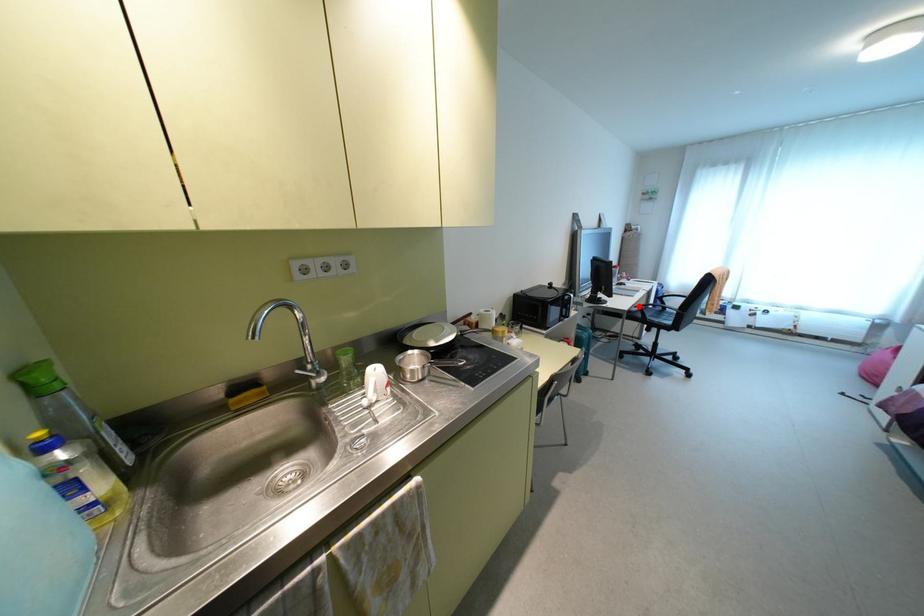
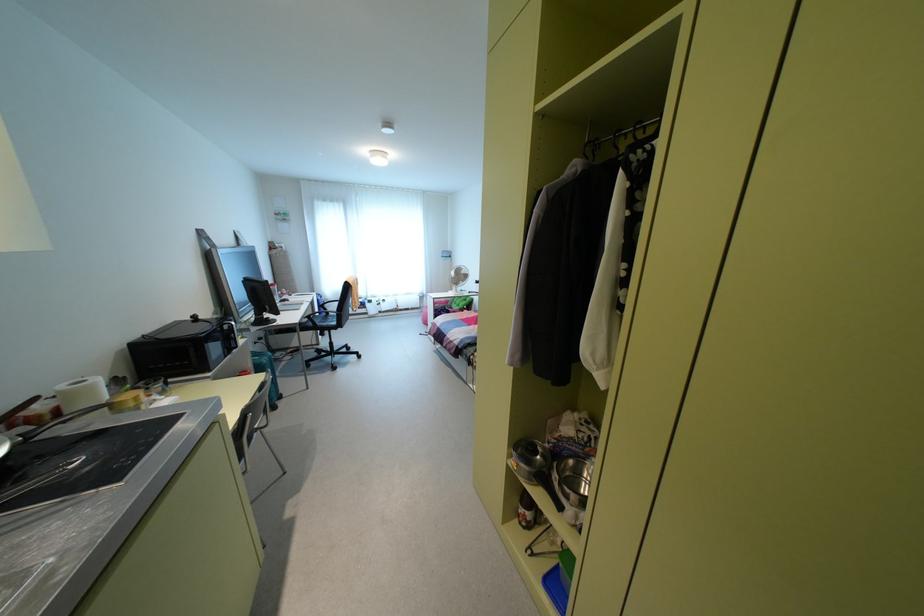
Question: I am providing you with two images of the same scene from different viewpoints. Given a red point in image1, look at the same physical point in image2. Is it:

Choices:
 (A) Closer to the viewpoint
 (B) Farther from the viewpoint

Answer: (A)